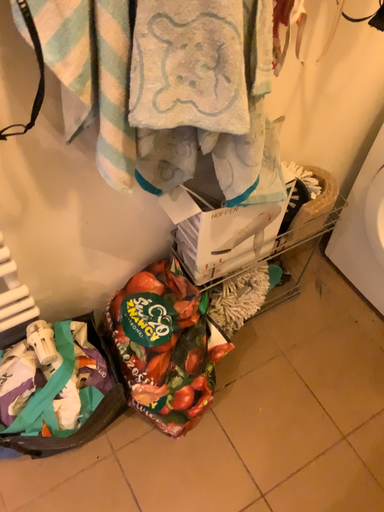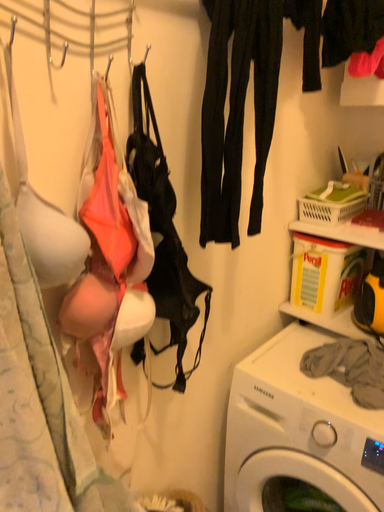
Question: Which way did the camera rotate in the video?

Choices:
 (A) rotated left
 (B) rotated right

Answer: (B)